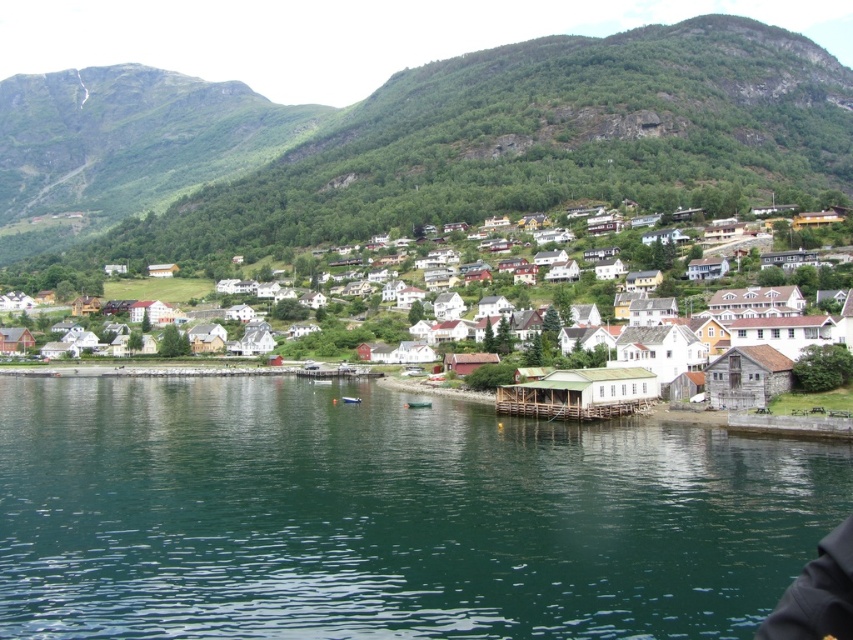
You are standing at the dock in the village and want to reach the green grassy hillside at upper center. Which direction should you head towards?

The green grassy hillside at upper center is located at point (421, 140), so you should head towards the upper center direction from the dock to reach it.

You are a visitor standing at the edge of the village, looking out towards the green water at lower center and the green grassy hillside at upper center. Which of these two features appears narrower from your perspective?

The green water at lower center appears narrower than the green grassy hillside at upper center because its width is less than that of the hillside.

You are a tourist standing at the dock and want to take a photo of the white wooden houses at lower right without the green water at lower center blocking the view. Is this possible?

The green water at lower center is in front of the white wooden houses at lower right, so it will block the view. Move to a higher position to avoid the water obscuring the houses.